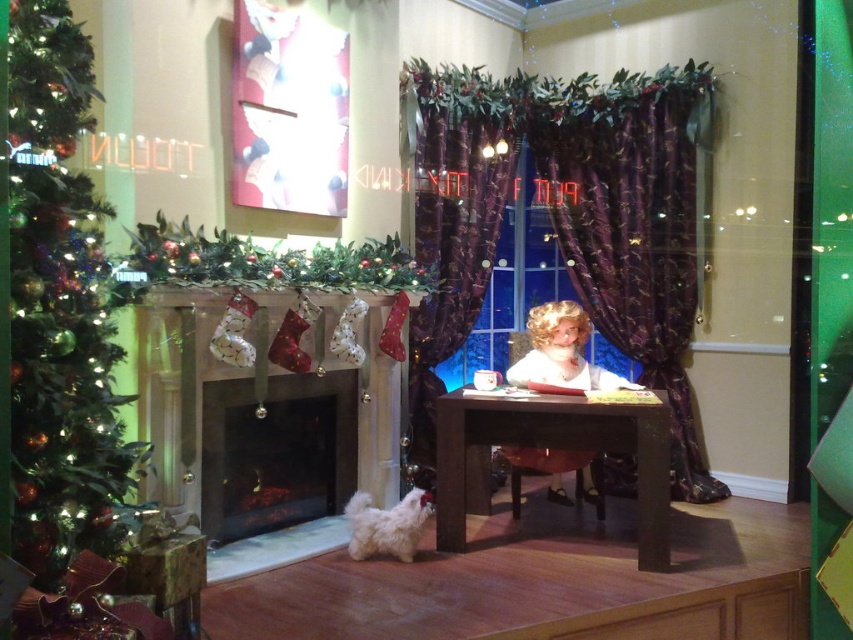
You are a customer in the store and want to take a photo of the green textured christmas tree at left and the brown wooden table at center. Which object should you focus on first if you want to capture both in the same frame without moving your camera?

Since the green textured christmas tree at left is positioned on the left side of the brown wooden table at center, you should focus on the green textured christmas tree at left first to ensure both objects are included in the frame.

You are a customer standing in front of the Christmas display. You see the purple satin curtains at center and the brown wooden table at center. Which object is located to the right of the other?

The purple satin curtains at center is positioned on the right side of brown wooden table at center, so the purple satin curtains at center is to the right of the brown wooden table at center.